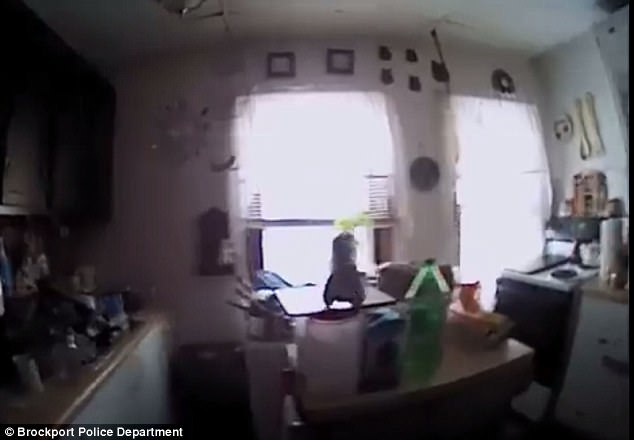
I want to click on chairs, so click(x=541, y=326), click(x=399, y=272).